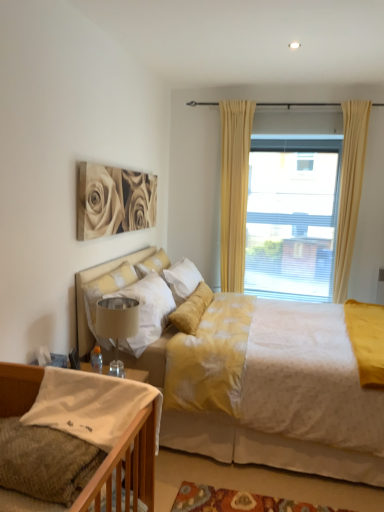
This screenshot has height=512, width=384. I want to click on vacant region above matte beige roses at upper left (from a real-world perspective), so [122, 165].